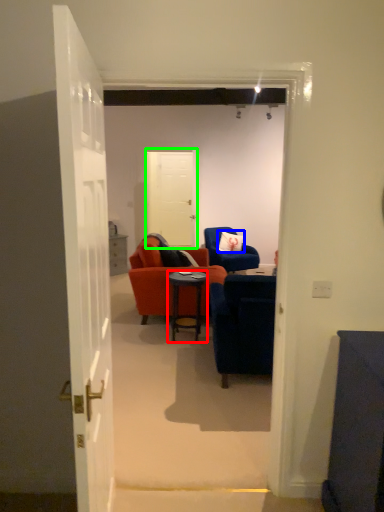
Question: Based on their relative distances, which object is farther from desk (highlighted by a red box)? Choose from pillow (highlighted by a blue box) and door (highlighted by a green box).

Choices:
 (A) pillow
 (B) door

Answer: (B)